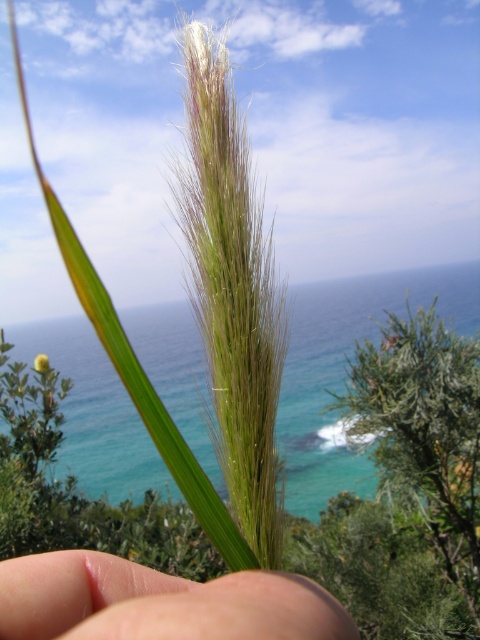
Between teal water at center and flesh/soft skin at center, which one appears on the left side from the viewer's perspective?

teal water at center

Where is `teal water at center`? Image resolution: width=480 pixels, height=640 pixels. teal water at center is located at coordinates (344, 369).

Does flesh/soft skin at center come in front of green fuzzy flower at center?

Yes, it is in front of green fuzzy flower at center.

Is flesh/soft skin at center positioned at the back of green fuzzy flower at center?

No, flesh/soft skin at center is closer to the viewer.

Describe the element at coordinates (158, 602) in the screenshot. Image resolution: width=480 pixels, height=640 pixels. I see `flesh/soft skin at center` at that location.

Locate an element on the screen. The height and width of the screenshot is (640, 480). flesh/soft skin at center is located at coordinates (158, 602).

Can you confirm if teal water at center is positioned to the left of green fuzzy flower at center?

Incorrect, teal water at center is not on the left side of green fuzzy flower at center.

Identify the location of teal water at center. (344, 369).